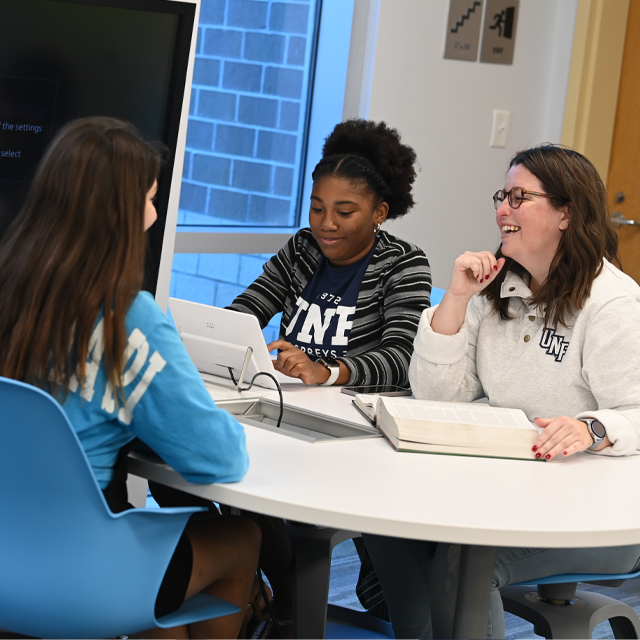
The height and width of the screenshot is (640, 640). Identify the location of door handle. (618, 220).